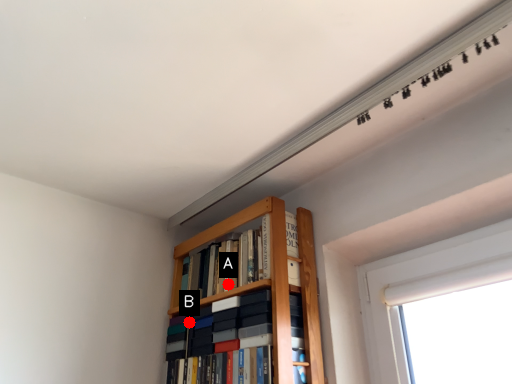
Question: Two points are circled on the image, labeled by A and B beside each circle. Which point is closer to the camera?

Choices:
 (A) A is closer
 (B) B is closer

Answer: (A)